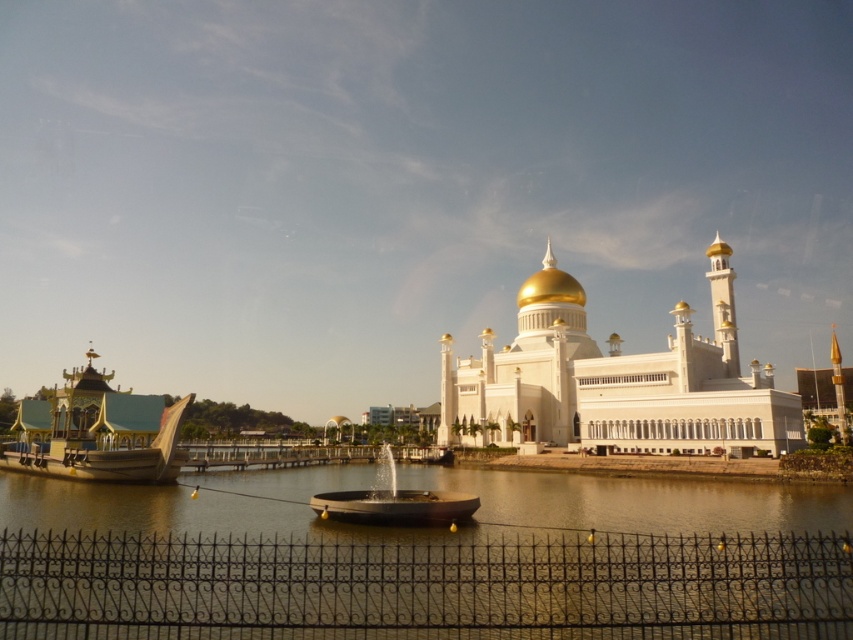
Question: Which point appears closest to the camera in this image?

Choices:
 (A) (463, 596)
 (B) (73, 371)

Answer: (A)

Question: Which point appears closest to the camera in this image?

Choices:
 (A) (80, 552)
 (B) (618, 429)
 (C) (27, 449)

Answer: (A)

Question: From the image, what is the correct spatial relationship of white glossy mosque at center in relation to gold polished wood boat at left?

Choices:
 (A) right
 (B) left

Answer: (A)

Question: Estimate the real-world distances between objects in this image. Which object is farther from the black wrought iron fence at lower center?

Choices:
 (A) white glossy mosque at center
 (B) gold polished wood boat at left

Answer: (A)

Question: Is black wrought iron fence at lower center wider than white glossy mosque at center?

Choices:
 (A) no
 (B) yes

Answer: (B)

Question: Is black wrought iron fence at lower center further to camera compared to gold polished wood boat at left?

Choices:
 (A) no
 (B) yes

Answer: (A)